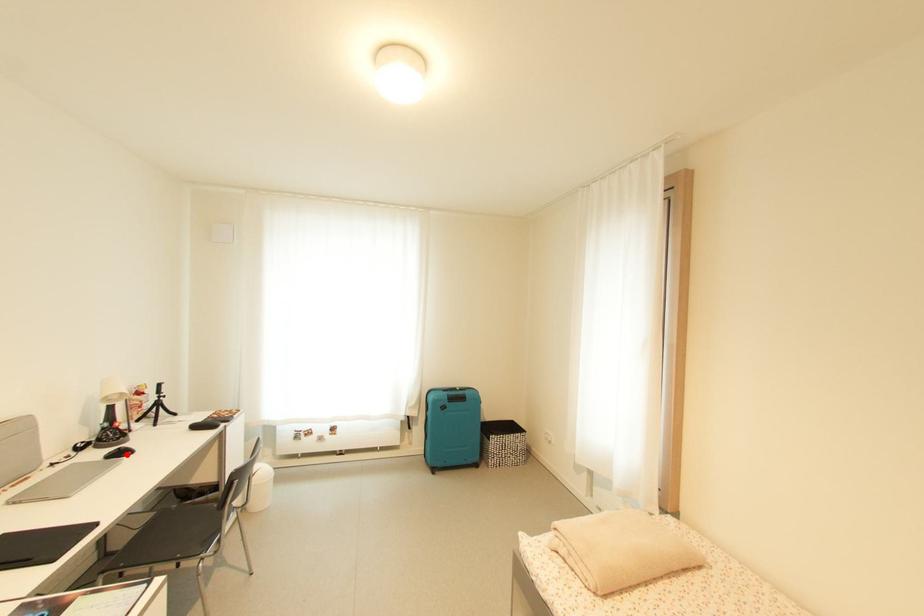
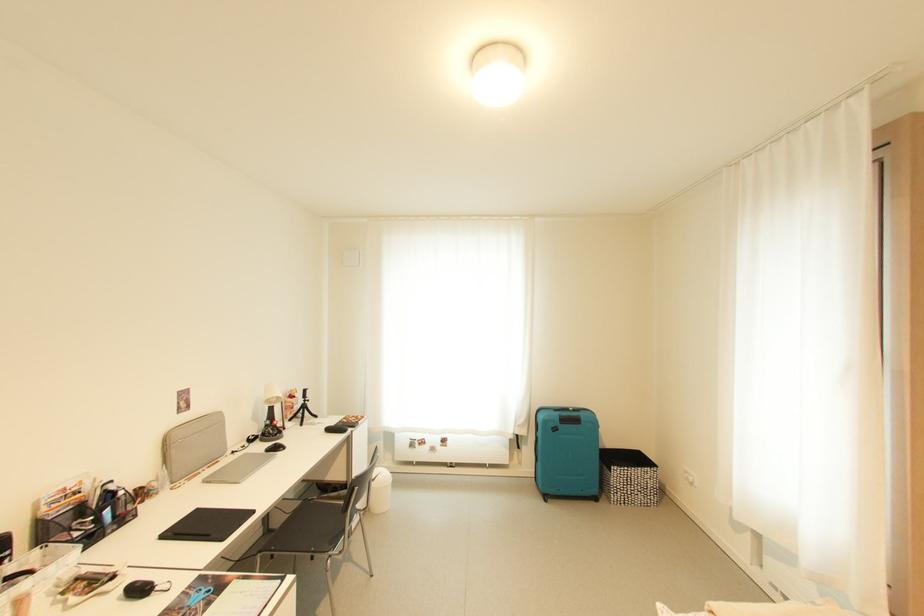
Locate, in the second image, the point that corresponds to the highlighted location in the first image.

(282, 450)